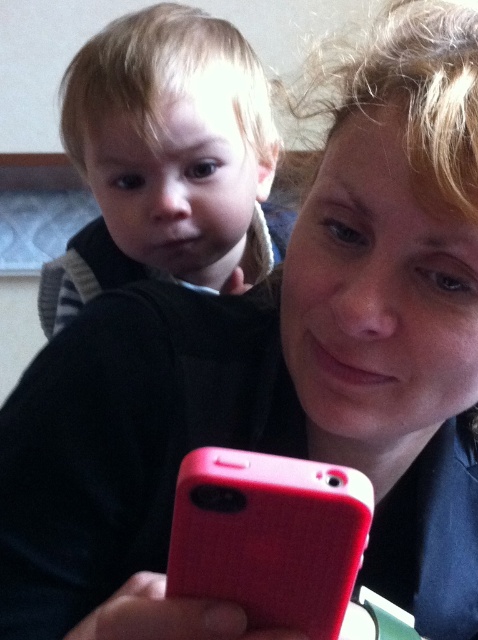
You are a photographer trying to capture the perfect selfie of the mother and child. The smooth blond hair toddler at upper left and the rubberized red phone at lower center are in your frame. Based on their positions, which object is higher in the image?

The smooth blond hair toddler at upper left is located above the rubberized red phone at lower center, so the smooth blond hair toddler at upper left is higher in the image.